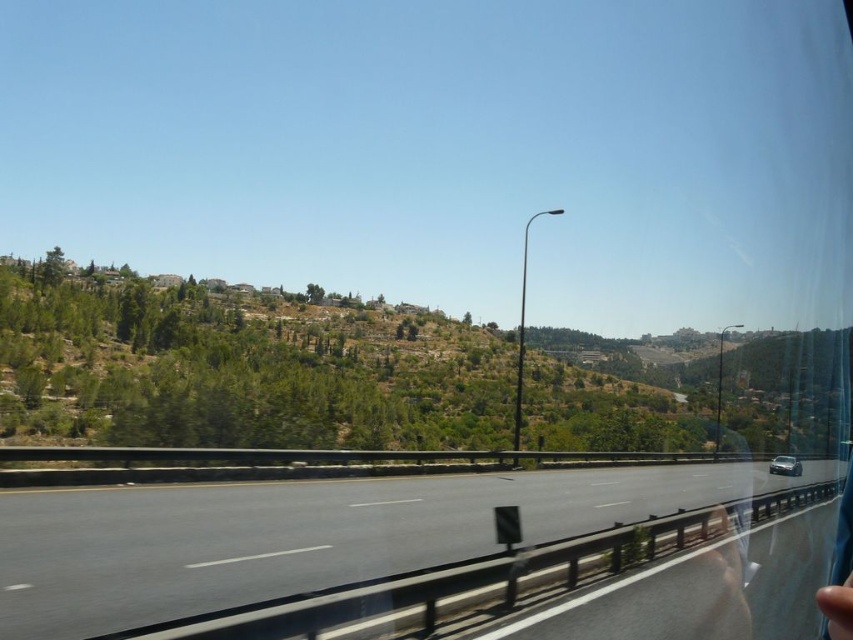
Question: Is black asphalt highway at center above silver metallic car at center?

Choices:
 (A) no
 (B) yes

Answer: (B)

Question: Which point appears farthest from the camera in this image?

Choices:
 (A) (48, 516)
 (B) (776, 456)

Answer: (B)

Question: Does black asphalt highway at center have a larger size compared to silver metallic car at center?

Choices:
 (A) yes
 (B) no

Answer: (A)

Question: Can you confirm if black asphalt highway at center is positioned above silver metallic car at center?

Choices:
 (A) no
 (B) yes

Answer: (B)

Question: Which of the following is the closest to the observer?

Choices:
 (A) silver metallic car at center
 (B) black asphalt highway at center

Answer: (B)

Question: Which point appears closest to the camera in this image?

Choices:
 (A) (549, 474)
 (B) (790, 465)

Answer: (A)